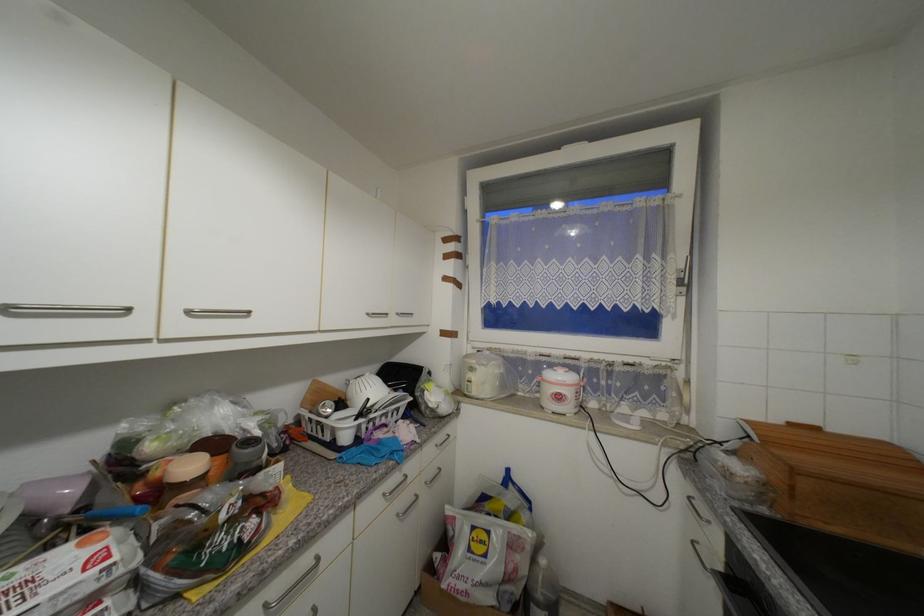
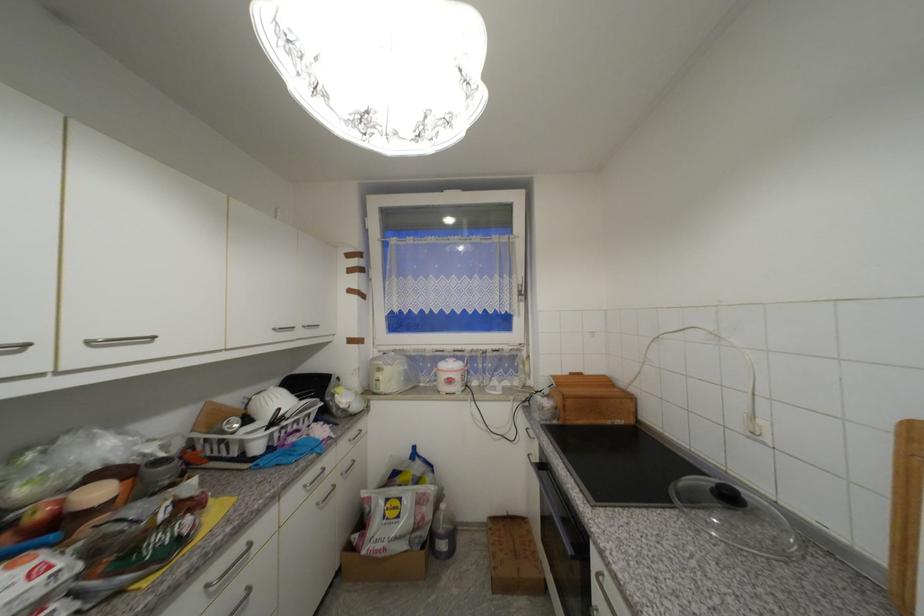
The point at (687,301) is marked in the first image. Where is the corresponding point in the second image?

(528, 306)